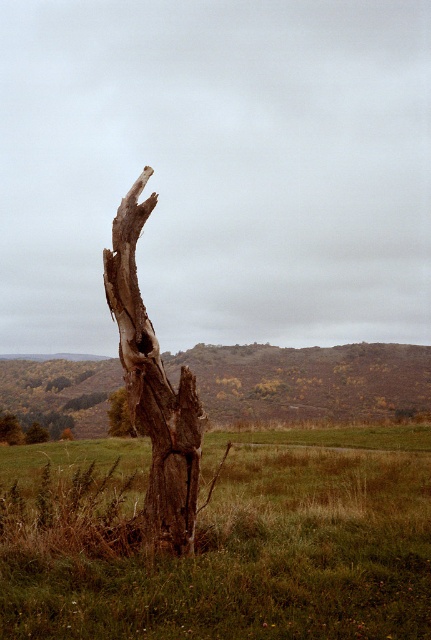
Question: Which object is closer to the camera taking this photo?

Choices:
 (A) green grassy at center
 (B) brown rough bark tree at center

Answer: (A)

Question: Which point is closer to the camera?

Choices:
 (A) brown rough bark tree trunk at center
 (B) green grassy at center
 (C) brown rough bark tree at center

Answer: (B)

Question: Is green grassy at center to the left of brown rough bark tree trunk at center from the viewer's perspective?

Choices:
 (A) yes
 (B) no

Answer: (A)

Question: Where is green grassy at center located in relation to brown rough bark tree trunk at center in the image?

Choices:
 (A) above
 (B) below

Answer: (B)

Question: In this image, where is green grassy at center located relative to brown rough bark tree at center?

Choices:
 (A) below
 (B) above

Answer: (A)

Question: Based on their relative distances, which object is nearer to the brown rough bark tree at center?

Choices:
 (A) green grassy at center
 (B) brown rough bark tree trunk at center

Answer: (B)